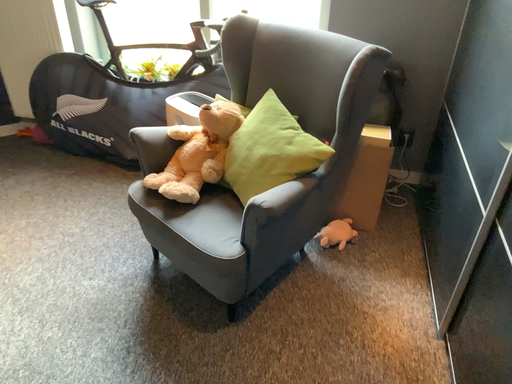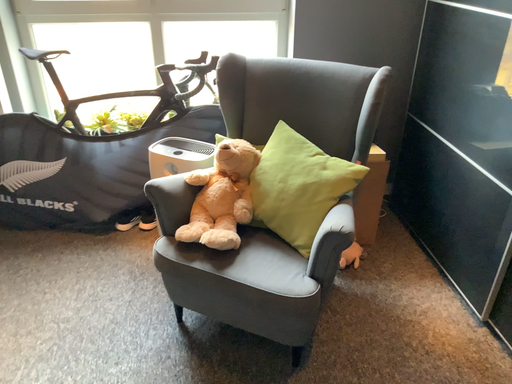
Question: Which way did the camera rotate in the video?

Choices:
 (A) rotated right
 (B) rotated left

Answer: (A)